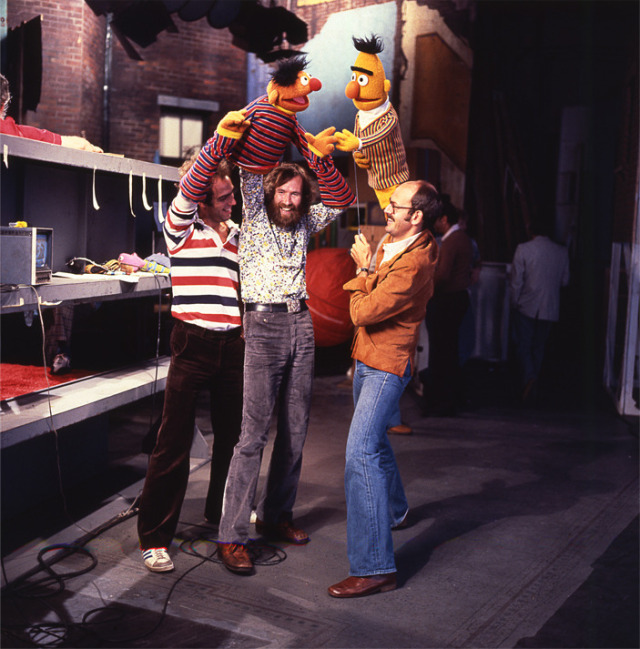
Where is `white shelves`? The width and height of the screenshot is (640, 649). white shelves is located at coordinates (84, 156), (75, 288), (100, 389).